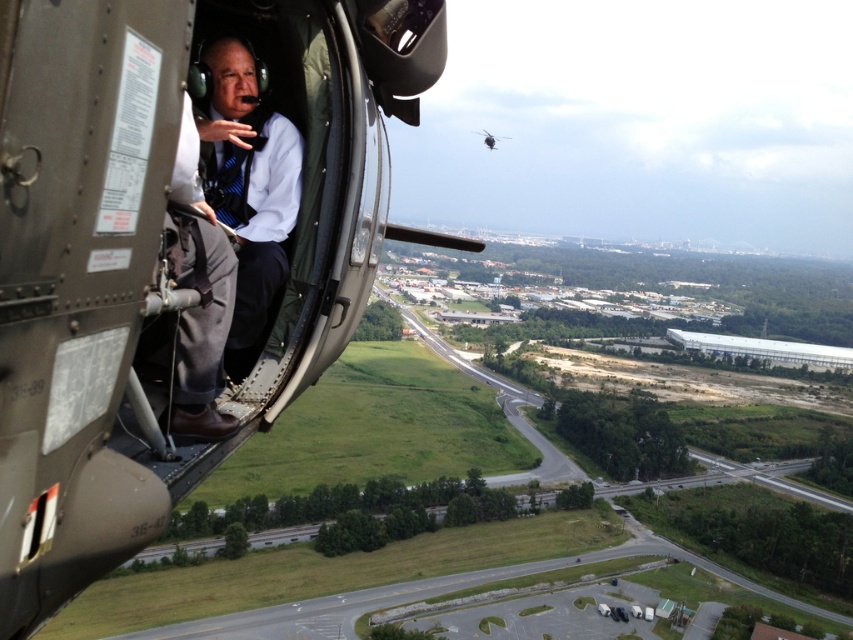
Looking at this image, you are a pilot flying a helicopter and need to land it. The metallic gray helicopter at left is at point 0.388, 0.205. Where should you position your helicopter to ensure a safe landing?

The metallic gray helicopter at left is at point (x=173, y=248), so you should position your helicopter away from that coordinate to avoid collision and ensure a safe landing.